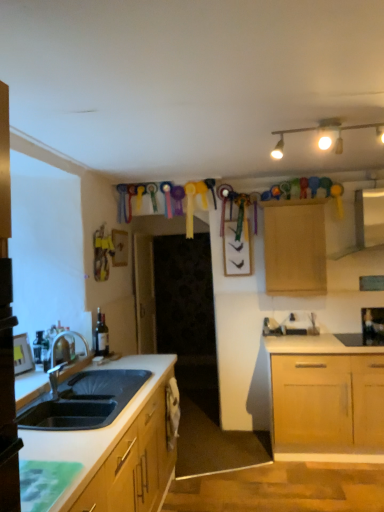
Question: Is wooden cabinet at upper center touching matte white exhaust hood at upper right?

Choices:
 (A) no
 (B) yes

Answer: (A)

Question: From a real-world perspective, is wooden cabinet at upper center below matte white exhaust hood at upper right?

Choices:
 (A) yes
 (B) no

Answer: (A)

Question: Does wooden cabinet at upper center have a lesser height compared to matte white exhaust hood at upper right?

Choices:
 (A) no
 (B) yes

Answer: (A)

Question: Considering the relative sizes of wooden cabinet at upper center and matte white exhaust hood at upper right in the image provided, is wooden cabinet at upper center bigger than matte white exhaust hood at upper right?

Choices:
 (A) yes
 (B) no

Answer: (A)

Question: Would you say wooden cabinet at upper center is a long distance from matte white exhaust hood at upper right?

Choices:
 (A) yes
 (B) no

Answer: (B)

Question: In the image, is wooden cabinet at upper center on the left side or the right side of black glass wine bottle at upper right?

Choices:
 (A) left
 (B) right

Answer: (A)

Question: In terms of height, does wooden cabinet at upper center look taller or shorter compared to black glass wine bottle at upper right?

Choices:
 (A) tall
 (B) short

Answer: (A)

Question: Is wooden cabinet at upper center inside the boundaries of black glass wine bottle at upper right, or outside?

Choices:
 (A) outside
 (B) inside

Answer: (A)

Question: In terms of size, does wooden cabinet at upper center appear bigger or smaller than black glass wine bottle at upper right?

Choices:
 (A) small
 (B) big

Answer: (B)

Question: From a real-world perspective, is matte white exhaust hood at upper right above or below wooden cabinet at upper center?

Choices:
 (A) below
 (B) above

Answer: (B)

Question: Is matte white exhaust hood at upper right in front of or behind wooden cabinet at upper center in the image?

Choices:
 (A) front
 (B) behind

Answer: (A)

Question: Considering the positions of point tap(355, 237) and point tap(307, 240), is point tap(355, 237) closer or farther from the camera than point tap(307, 240)?

Choices:
 (A) closer
 (B) farther

Answer: (B)

Question: Is matte white exhaust hood at upper right to the left or to the right of wooden cabinet at upper center in the image?

Choices:
 (A) left
 (B) right

Answer: (B)

Question: Considering the positions of matte gold track lights at upper center and wooden cabinet at upper center in the image, is matte gold track lights at upper center taller or shorter than wooden cabinet at upper center?

Choices:
 (A) short
 (B) tall

Answer: (A)

Question: Considering the positions of matte gold track lights at upper center and wooden cabinet at upper center in the image, is matte gold track lights at upper center bigger or smaller than wooden cabinet at upper center?

Choices:
 (A) big
 (B) small

Answer: (B)